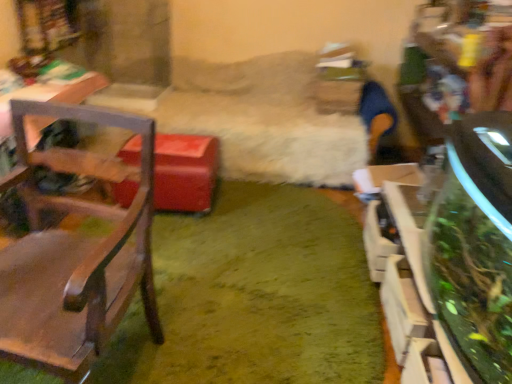
Question: Considering the relative sizes of wooden chair at left and green plush carpet at center in the image provided, is wooden chair at left taller than green plush carpet at center?

Choices:
 (A) yes
 (B) no

Answer: (A)

Question: Considering the relative sizes of wooden chair at left and green plush carpet at center in the image provided, is wooden chair at left shorter than green plush carpet at center?

Choices:
 (A) yes
 (B) no

Answer: (B)

Question: Does wooden chair at left turn towards green plush carpet at center?

Choices:
 (A) yes
 (B) no

Answer: (B)

Question: From the image's perspective, is wooden chair at left on top of green plush carpet at center?

Choices:
 (A) yes
 (B) no

Answer: (A)

Question: From a real-world perspective, is wooden chair at left below green plush carpet at center?

Choices:
 (A) yes
 (B) no

Answer: (B)

Question: From a real-world perspective, is wooden chair at left physically above green plush carpet at center?

Choices:
 (A) no
 (B) yes

Answer: (B)

Question: Is green plush carpet at center positioned far away from green leafy plant at right?

Choices:
 (A) no
 (B) yes

Answer: (A)

Question: From the image's perspective, is green plush carpet at center located beneath green leafy plant at right?

Choices:
 (A) yes
 (B) no

Answer: (B)

Question: Could green leafy plant at right be considered to be inside green plush carpet at center?

Choices:
 (A) yes
 (B) no

Answer: (B)

Question: Is green plush carpet at center smaller than green leafy plant at right?

Choices:
 (A) no
 (B) yes

Answer: (B)

Question: From a real-world perspective, is green plush carpet at center on green leafy plant at right?

Choices:
 (A) no
 (B) yes

Answer: (A)

Question: Is green plush carpet at center facing away from green leafy plant at right?

Choices:
 (A) yes
 (B) no

Answer: (B)

Question: From a real-world perspective, is wooden chair at left on top of green leafy plant at right?

Choices:
 (A) yes
 (B) no

Answer: (A)